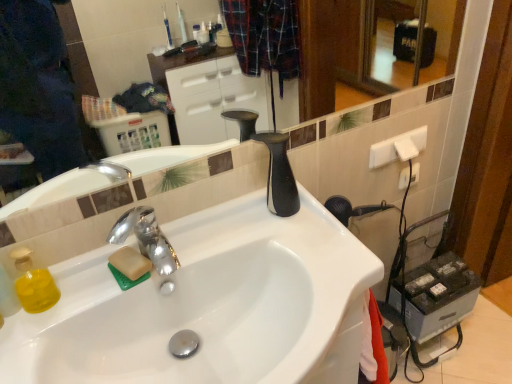
Where is `free space to the back side of chrome metallic faucet at center`? The height and width of the screenshot is (384, 512). free space to the back side of chrome metallic faucet at center is located at coordinates (197, 237).